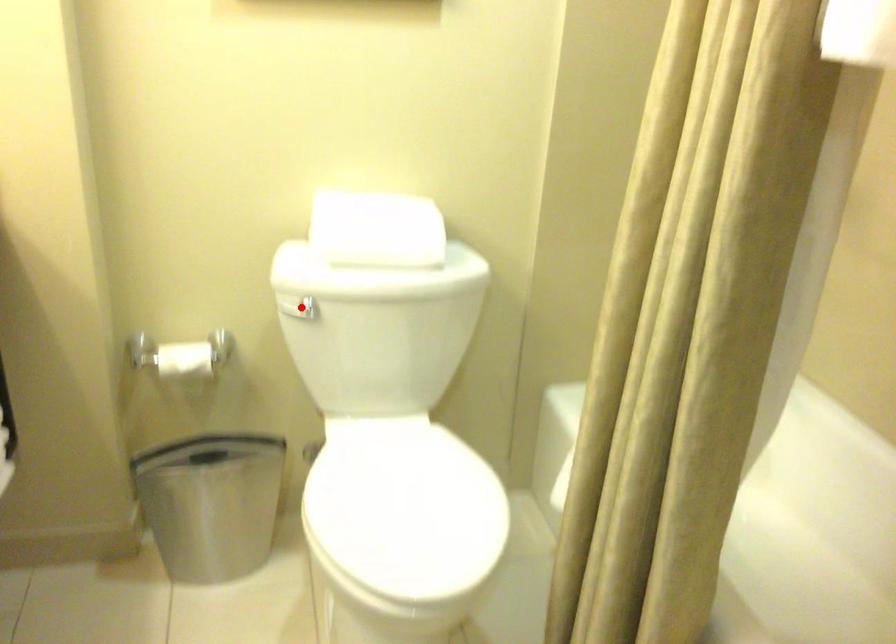
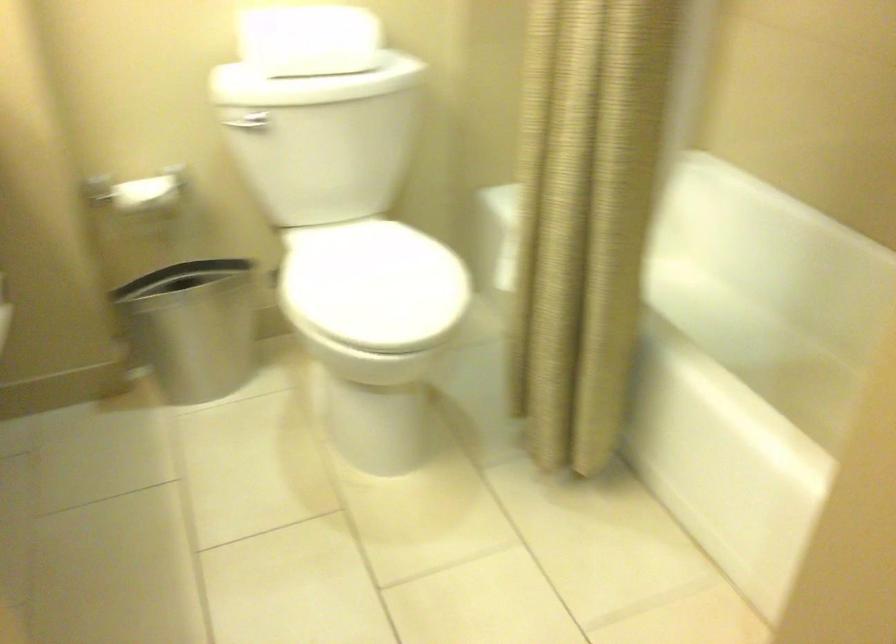
Find the pixel in the second image that matches the highlighted location in the first image.

(247, 122)